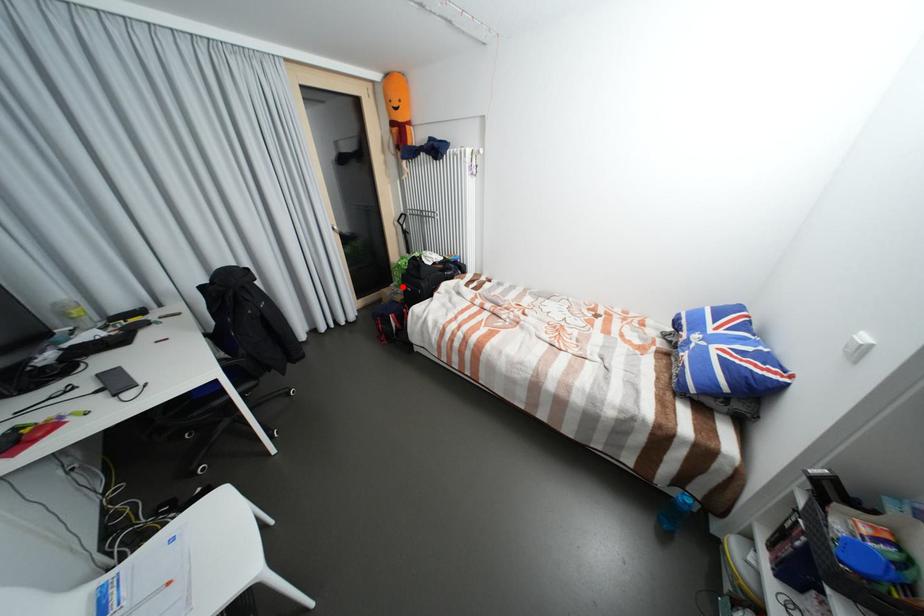
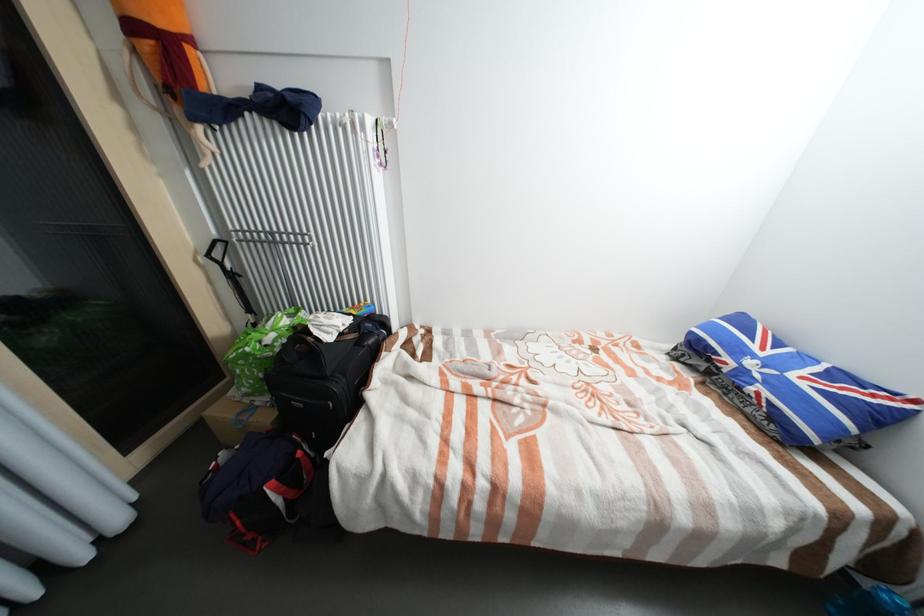
Question: I am providing you with two images of the same scene from different viewpoints. In image1, a red point is highlighted. Considering the same 3D point in image2, which of the following is correct?

Choices:
 (A) It is closer
 (B) It is farther

Answer: (A)